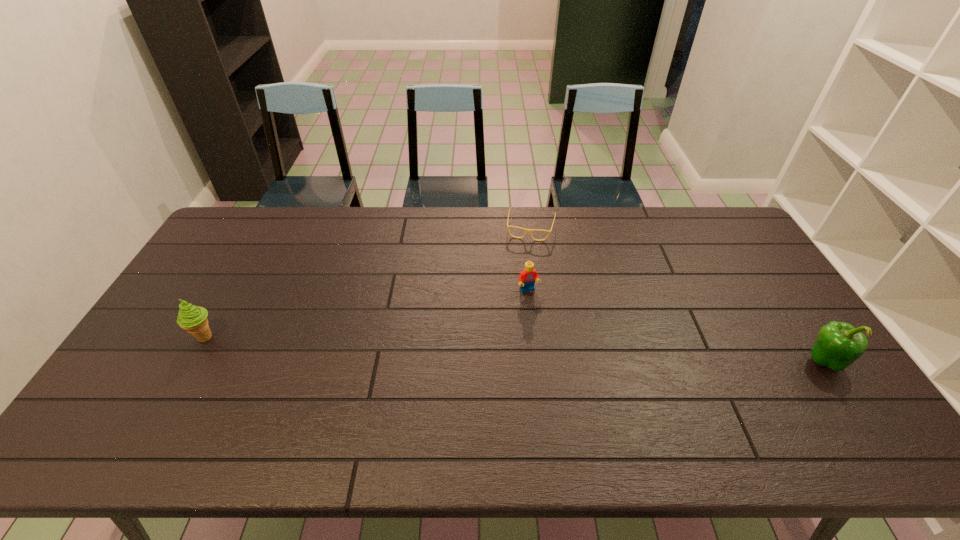
Identify the location of vacant space on the desktop that is between the leftmost object and the rightmost object and is positioned on the face of the Lego. This screenshot has width=960, height=540. (558, 350).

Locate an element on the screen. free spot on the desktop that is between the leftmost object and the bell pepper and is positioned in front of the lenses of the shortest object is located at coordinates 507,349.